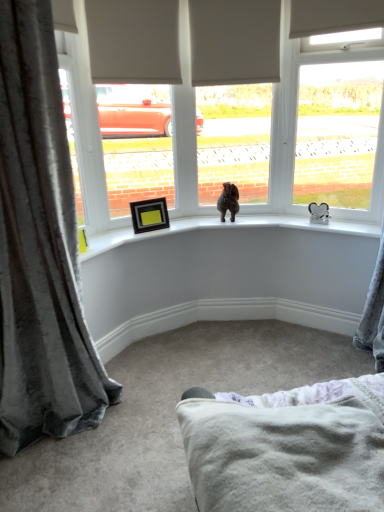
What are the coordinates of `unoccupied region to the right of brown plush bear at center` in the screenshot? It's located at (254, 219).